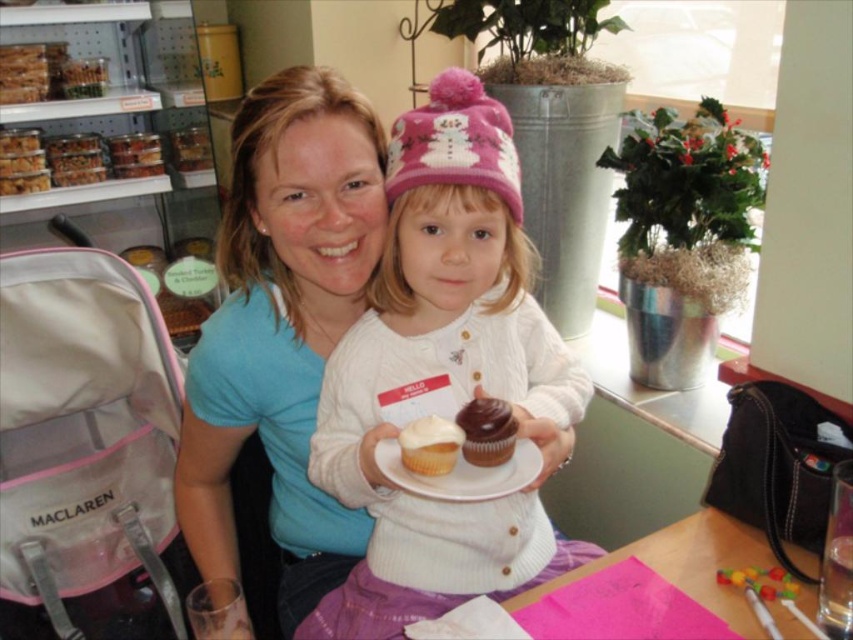
Question: Estimate the real-world distances between objects in this image. Which object is farther from the white knit sweater at center?

Choices:
 (A) matte blue shirt at center
 (B) white paper plate at center
 (C) chocolate matte muffin at center
 (D) white matte cupcake at center

Answer: (D)

Question: Among these points, which one is farthest from the camera?

Choices:
 (A) (524, 465)
 (B) (241, 252)
 (C) (434, 224)

Answer: (B)

Question: From the image, what is the correct spatial relationship of white paper plate at center in relation to white matte cupcake at center?

Choices:
 (A) left
 (B) right

Answer: (B)

Question: Does chocolate matte muffin at center have a larger size compared to white matte cupcake at center?

Choices:
 (A) no
 (B) yes

Answer: (A)

Question: Based on their relative distances, which object is nearer to the white matte cupcake at center?

Choices:
 (A) white paper plate at center
 (B) chocolate matte muffin at center
 (C) white knit sweater at center
 (D) matte blue shirt at center

Answer: (B)

Question: Is chocolate matte muffin at center wider than white matte cupcake at center?

Choices:
 (A) yes
 (B) no

Answer: (B)